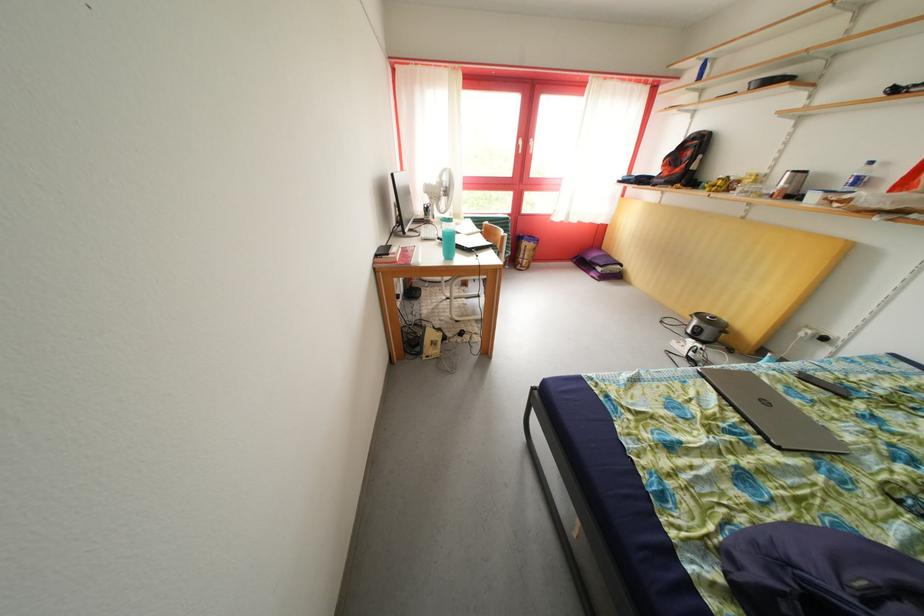
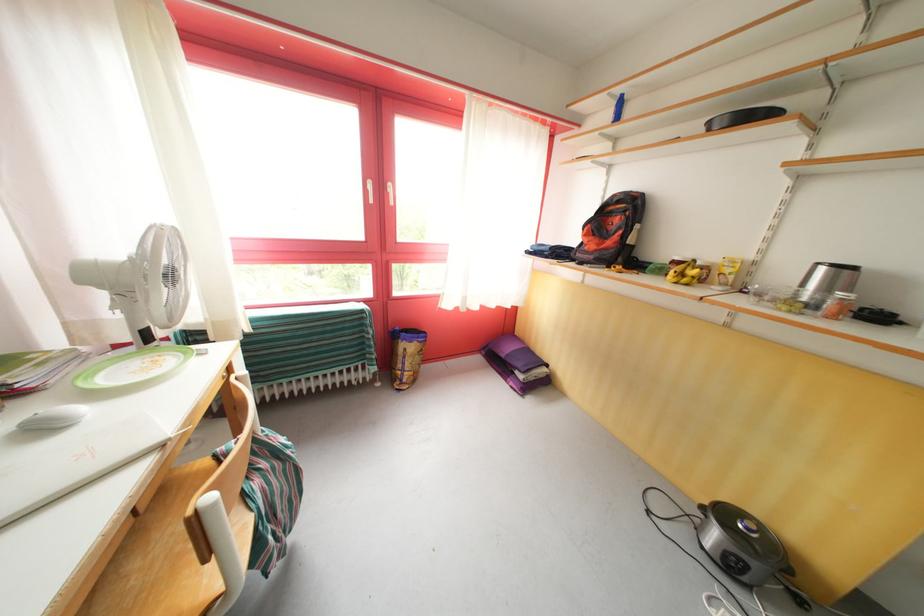
Find the pixel in the second image that matches [663,176] in the first image.

(580, 245)